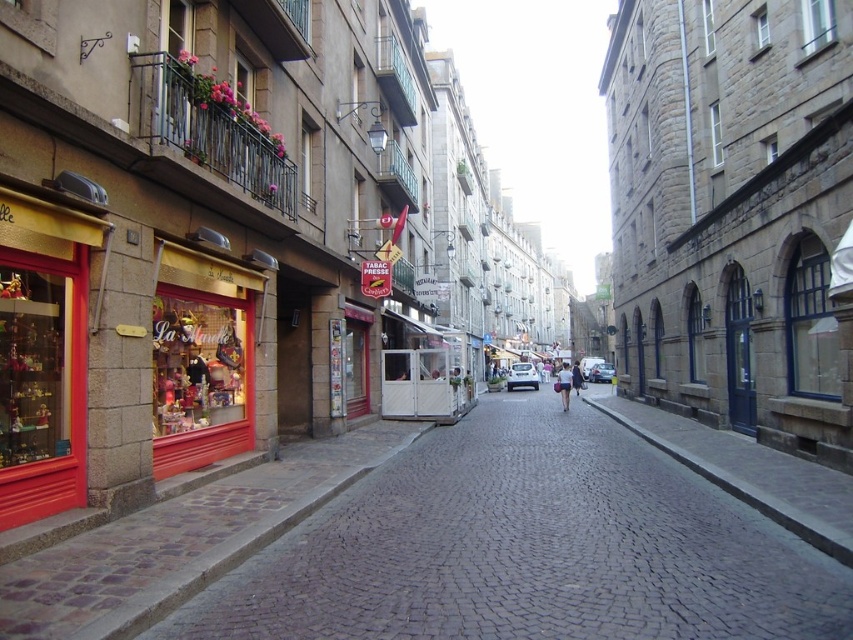
Question: Is cobblestone pavement at center above dark gray stone wall at center?

Choices:
 (A) no
 (B) yes

Answer: (B)

Question: Can you confirm if cobblestone pavement at center is smaller than dark gray stone wall at center?

Choices:
 (A) no
 (B) yes

Answer: (B)

Question: Is cobblestone pavement at center further to the viewer compared to dark gray stone wall at center?

Choices:
 (A) no
 (B) yes

Answer: (A)